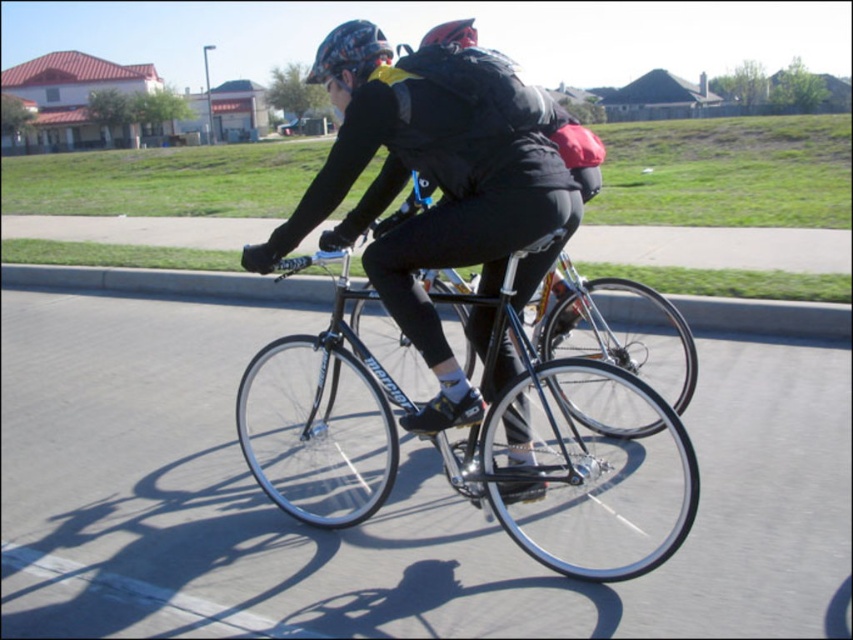
Question: Among these objects, which one is nearest to the camera?

Choices:
 (A) matte black bicycle at center
 (B) shiny black bicycle at center

Answer: (B)

Question: Which of the following is the farthest from the observer?

Choices:
 (A) shiny black bicycle at center
 (B) matte black bicycle at center
 (C) shiny red helmet at upper center

Answer: (C)

Question: Considering the relative positions of matte black bicycle at center and shiny black bicycle at center in the image provided, where is matte black bicycle at center located with respect to shiny black bicycle at center?

Choices:
 (A) right
 (B) left

Answer: (A)

Question: From the image, what is the correct spatial relationship of matte black bicycle at center in relation to shiny red helmet at upper center?

Choices:
 (A) right
 (B) left

Answer: (A)

Question: Can you confirm if shiny black bicycle at center is positioned to the right of shiny red helmet at upper center?

Choices:
 (A) no
 (B) yes

Answer: (B)

Question: Estimate the real-world distances between objects in this image. Which object is farther from the shiny black bicycle at center?

Choices:
 (A) matte black bicycle at center
 (B) shiny red helmet at upper center

Answer: (B)